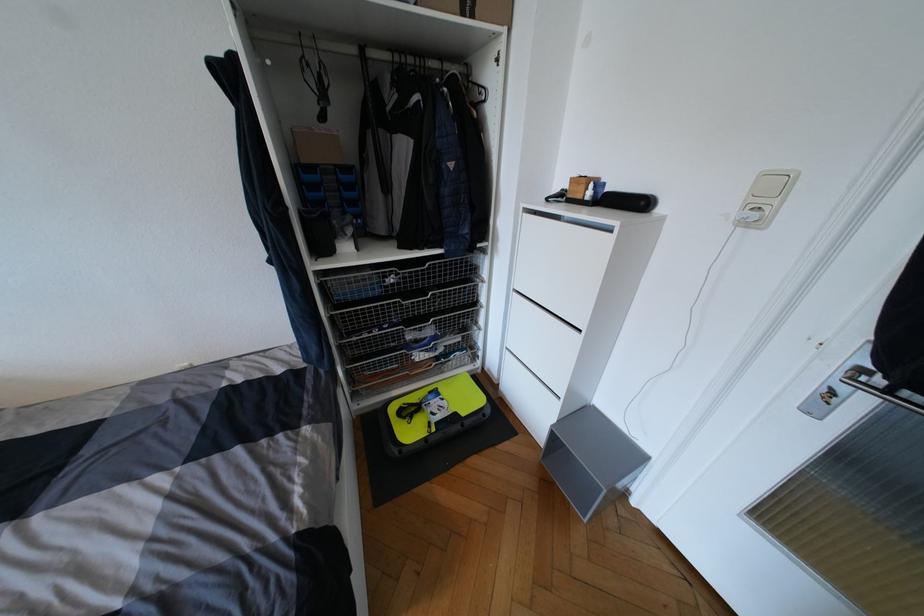
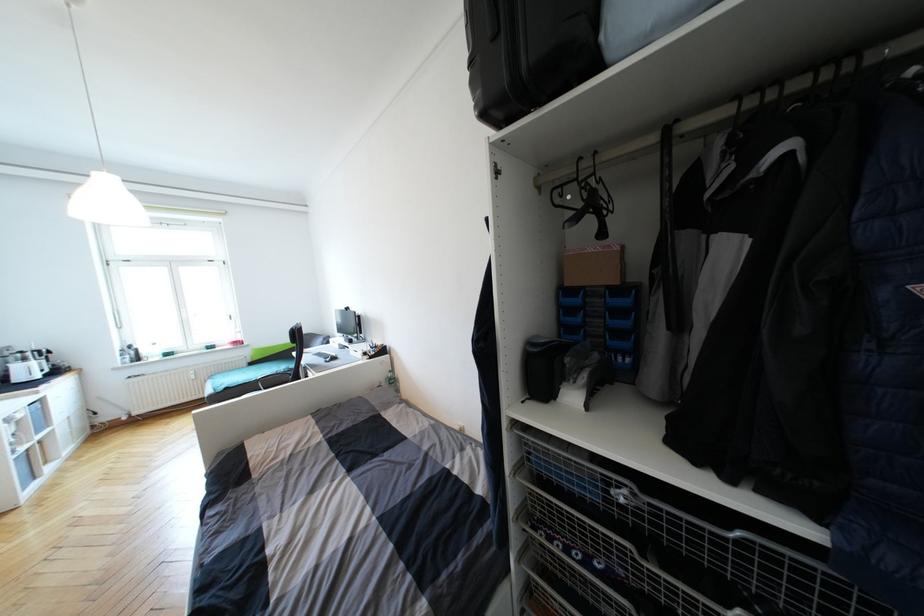
Question: The camera is either moving clockwise (left) or counter-clockwise (right) around the object. The first image is from the beginning of the video and the second image is from the end. Is the camera moving left or right when shooting the video?

Choices:
 (A) Left
 (B) Right

Answer: (B)